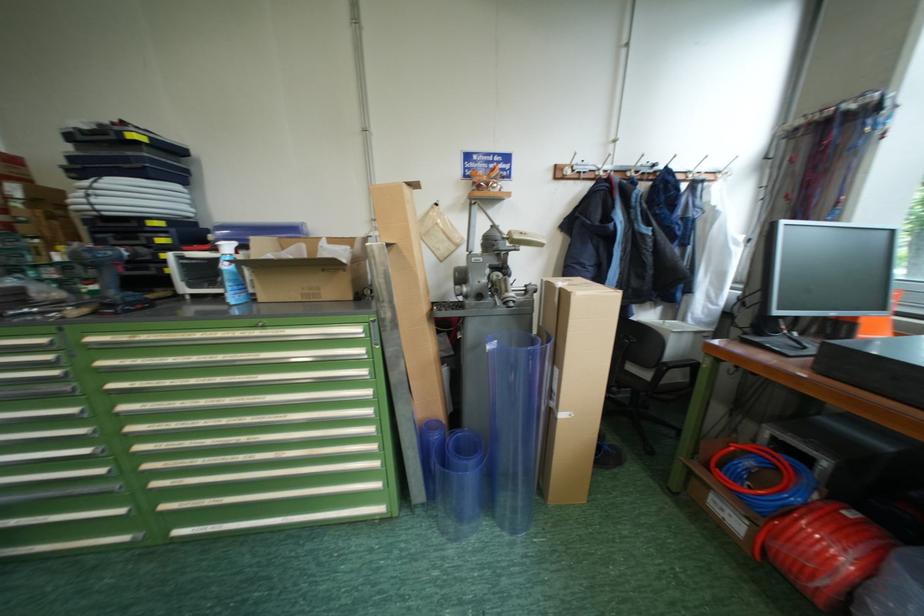
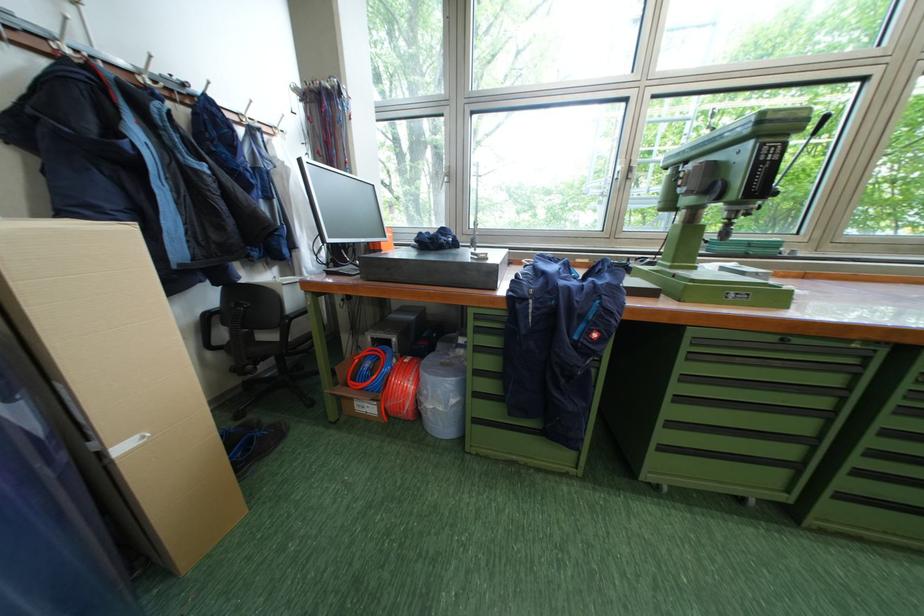
Where in the second image is the point corresponding to point 796,515 from the first image?

(396, 383)